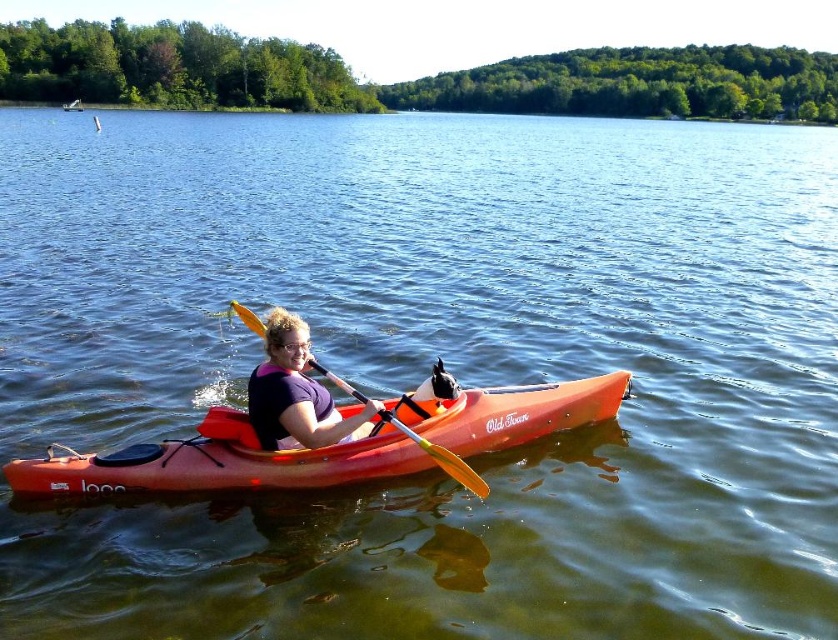
Measure the distance from matte purple shirt at center to purple fabric life jacket at center.

A distance of 3.22 inches exists between matte purple shirt at center and purple fabric life jacket at center.

Does matte purple shirt at center have a lesser width compared to purple fabric life jacket at center?

No.

What do you see at coordinates (296, 394) in the screenshot? I see `matte purple shirt at center` at bounding box center [296, 394].

The height and width of the screenshot is (640, 838). What are the coordinates of `matte purple shirt at center` in the screenshot? It's located at (296, 394).

Does orange matte kayak at center appear under matte purple shirt at center?

Correct, orange matte kayak at center is located below matte purple shirt at center.

Between point (469, 396) and point (301, 392), which one is positioned behind?

Positioned behind is point (469, 396).

Does point (339, 460) come in front of point (353, 426)?

No.

I want to click on orange matte kayak at center, so click(x=216, y=461).

Looking at this image, can you confirm if orange matte kayak at center is positioned above purple fabric life jacket at center?

Incorrect, orange matte kayak at center is not positioned above purple fabric life jacket at center.

Is point (487, 449) positioned after point (277, 380)?

Yes.

Locate an element on the screen. The image size is (838, 640). orange matte kayak at center is located at coordinates (216, 461).